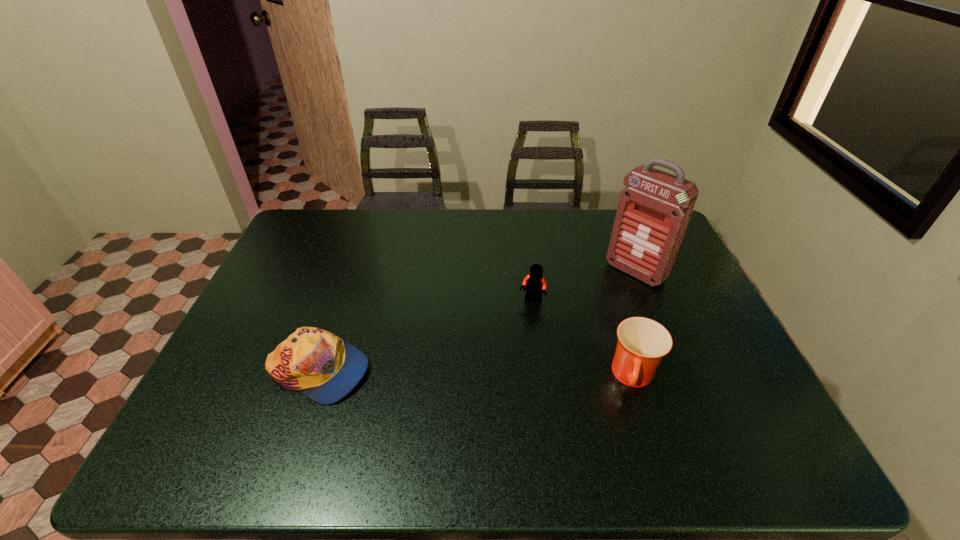
Locate an element on the screen. Image resolution: width=960 pixels, height=540 pixels. vacant region at the far edge of the desktop is located at coordinates (495, 218).

In the image, there is a desktop. Identify the location of blank space at the left edge. (246, 354).

You are a GUI agent. You are given a task and a screenshot of the screen. Output one action in this format:
    pyautogui.click(x=<x>, y=<y>)
    Task: Click on the vacant space at the far left corner of the desktop
    The height and width of the screenshot is (540, 960).
    Given the screenshot: What is the action you would take?
    pyautogui.click(x=290, y=235)

The height and width of the screenshot is (540, 960). What are the coordinates of `vacant space that is in between the first-aid kit and the shortest object` in the screenshot? It's located at (477, 321).

The width and height of the screenshot is (960, 540). I want to click on free space that is in between the second object from left to right and the cup, so click(583, 340).

Find the location of a particular element. The image size is (960, 540). free area in between the shortest object and the cup is located at coordinates (476, 375).

At what (x,y) coordinates should I click in order to perform the action: click on free space between the third nearest object and the farthest object. Please return your answer as a coordinate pair (x, y). Looking at the image, I should click on (584, 286).

Locate an element on the screen. The height and width of the screenshot is (540, 960). free area in between the cup and the leftmost object is located at coordinates (476, 375).

You are a GUI agent. You are given a task and a screenshot of the screen. Output one action in this format:
    pyautogui.click(x=<x>, y=<y>)
    Task: Click on the vacant area that lies between the third nearest object and the cup
    Image resolution: width=960 pixels, height=540 pixels.
    Given the screenshot: What is the action you would take?
    pyautogui.click(x=583, y=340)

This screenshot has width=960, height=540. Identify the location of free space between the cup and the shortest object. (476, 375).